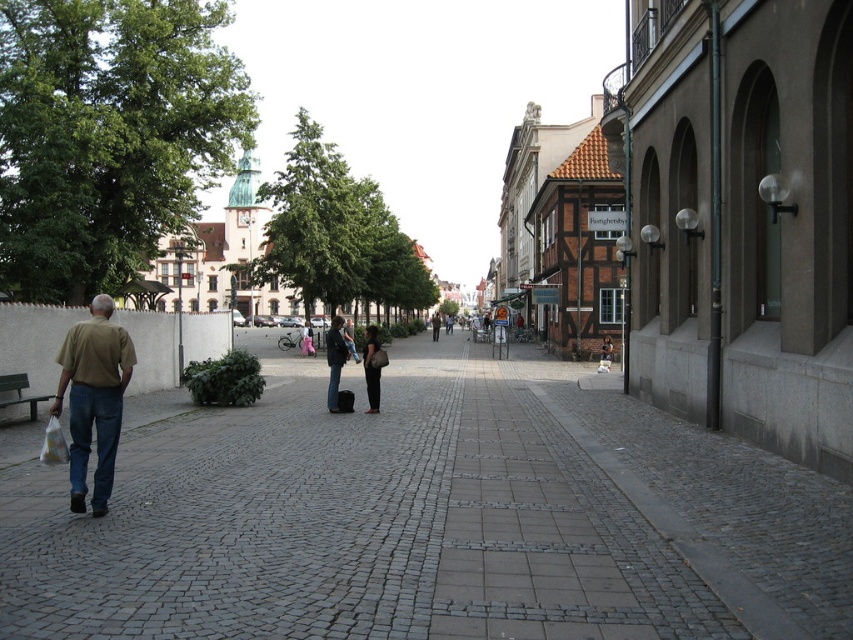
You are standing at the point marked by coordinates point (432,518), which is on the gray cobblestone pavement at center. You want to walk straight ahead to the nearest building on the right side of the street. Which direction should you turn to reach the nearest building on the right side of the street?

Since you are standing on the gray cobblestone pavement at center, the nearest building on the right side of the street is directly ahead. Therefore, you don not need to turn left or right to reach it. Walk straight ahead.

You are a tourist standing in the middle of the street looking forward. You see a light brown shirt at center and a matte black suitcase at center. Which object is closer to you?

The light brown shirt at center is closer to you because it is in front of the matte black suitcase at center.

You are standing at the entrance of the street and want to walk to the gray cobblestone pavement at center. Based on the coordinates provided, in which direction should you move relative to your current position?

The gray cobblestone pavement at center is located at coordinates point (432, 518), so you should move forward and slightly to the right to reach it.